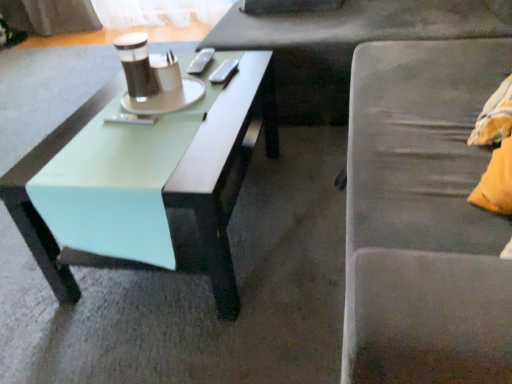
Question: Considering the relative positions of silver metallic remote control at center, which is the second remote control from front to back, and matte black cup at center in the image provided, is silver metallic remote control at center, which is the second remote control from front to back, to the left of matte black cup at center from the viewer's perspective?

Choices:
 (A) yes
 (B) no

Answer: (B)

Question: Is silver metallic remote control at center, which is the second remote control from front to back, thinner than matte black cup at center?

Choices:
 (A) no
 (B) yes

Answer: (B)

Question: Does silver metallic remote control at center, which is the second remote control from front to back, come in front of matte black cup at center?

Choices:
 (A) yes
 (B) no

Answer: (B)

Question: From the image's perspective, is silver metallic remote control at center, which is the 2th remote control from bottom to top, above matte black cup at center?

Choices:
 (A) yes
 (B) no

Answer: (A)

Question: Would you say silver metallic remote control at center, the 1th remote control in the right-to-left sequence, is outside matte black cup at center?

Choices:
 (A) no
 (B) yes

Answer: (B)

Question: Considering the relative sizes of silver metallic remote control at center, positioned as the 2th remote control in back-to-front order, and matte black cup at center in the image provided, is silver metallic remote control at center, positioned as the 2th remote control in back-to-front order, bigger than matte black cup at center?

Choices:
 (A) no
 (B) yes

Answer: (A)

Question: Considering the relative sizes of mint green wood coffee table at left and matte black cup at center in the image provided, is mint green wood coffee table at left taller than matte black cup at center?

Choices:
 (A) yes
 (B) no

Answer: (A)

Question: From a real-world perspective, is mint green wood coffee table at left over matte black cup at center?

Choices:
 (A) yes
 (B) no

Answer: (B)

Question: Can you confirm if mint green wood coffee table at left is wider than matte black cup at center?

Choices:
 (A) yes
 (B) no

Answer: (A)

Question: Is there a large distance between mint green wood coffee table at left and matte black cup at center?

Choices:
 (A) no
 (B) yes

Answer: (A)

Question: From the image's perspective, does mint green wood coffee table at left appear lower than matte black cup at center?

Choices:
 (A) no
 (B) yes

Answer: (B)

Question: Can you confirm if mint green wood coffee table at left is thinner than matte black cup at center?

Choices:
 (A) no
 (B) yes

Answer: (A)

Question: Is matte black remote control at center, positioned as the third remote control in right-to-left order, smaller than metallic silver remote control at center, the 2th remote control from the right?

Choices:
 (A) no
 (B) yes

Answer: (B)